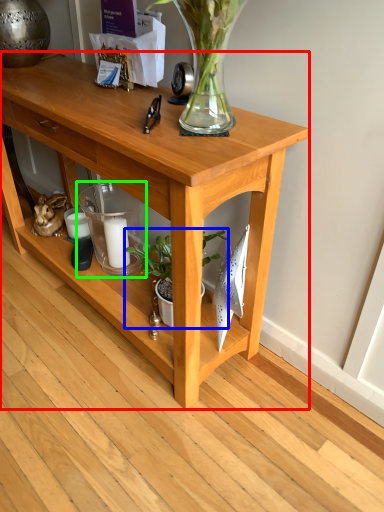
Question: Which is farther away from table (highlighted by a red box)? houseplant (highlighted by a blue box) or candle holder (highlighted by a green box)?

Choices:
 (A) houseplant
 (B) candle holder

Answer: (A)